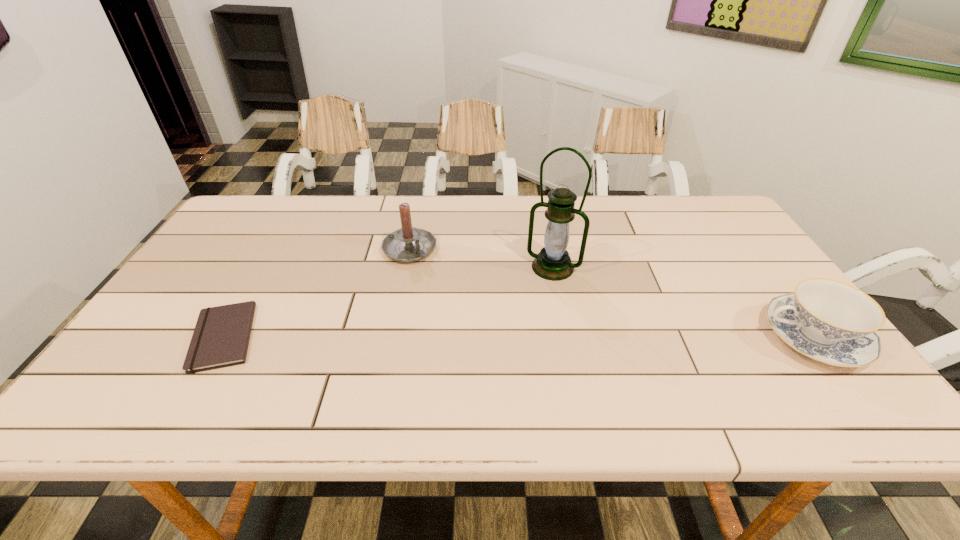
The image size is (960, 540). What are the coordinates of `checkbook` in the screenshot? It's located at (221, 336).

This screenshot has width=960, height=540. In order to click on the leftmost object in this screenshot , I will do `click(221, 336)`.

Find the location of a particular element. This screenshot has height=540, width=960. the second shortest object is located at coordinates (829, 321).

Where is `the rightmost object`? This screenshot has height=540, width=960. the rightmost object is located at coordinates (829, 321).

You are a GUI agent. You are given a task and a screenshot of the screen. Output one action in this format:
    pyautogui.click(x=<x>, y=<y>)
    Task: Click on the tallest object
    The width and height of the screenshot is (960, 540).
    Given the screenshot: What is the action you would take?
    pyautogui.click(x=553, y=262)

Where is `lantern`? This screenshot has height=540, width=960. lantern is located at coordinates (553, 262).

This screenshot has height=540, width=960. In order to click on the third shortest object in this screenshot , I will do `click(408, 244)`.

The width and height of the screenshot is (960, 540). In order to click on the second object from left to right in this screenshot , I will do `click(408, 244)`.

Identify the location of vacant space located on the right of the shortest object. (330, 337).

Locate an element on the screen. free space located with the handle on the side of the chinaware is located at coordinates (620, 337).